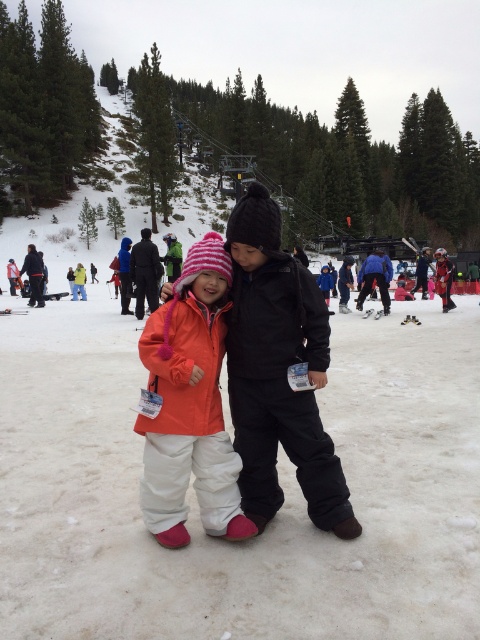
Who is shorter, orange softshell jacket at center or orange fleece jacket at center?

With less height is orange softshell jacket at center.

Is point (154, 314) closer to camera compared to point (148, 301)?

That is True.

What do you see at coordinates (190, 404) in the screenshot? The height and width of the screenshot is (640, 480). I see `orange softshell jacket at center` at bounding box center [190, 404].

Image resolution: width=480 pixels, height=640 pixels. Identify the location of orange softshell jacket at center. (190, 404).

Is black matte jacket at center to the right of orange softshell jacket at center from the viewer's perspective?

Correct, you'll find black matte jacket at center to the right of orange softshell jacket at center.

Can you confirm if black matte jacket at center is thinner than orange softshell jacket at center?

No.

Is point (274, 508) in front of point (163, 355)?

No, it is not.

Identify the location of black matte jacket at center. This screenshot has width=480, height=640. (278, 371).

Is black matte jacket at center shorter than orange fleece jacket at center?

Yes.

Is point (324, 488) positioned behind point (156, 269)?

No, it is not.

This screenshot has width=480, height=640. In order to click on black matte jacket at center in this screenshot , I will do `click(278, 371)`.